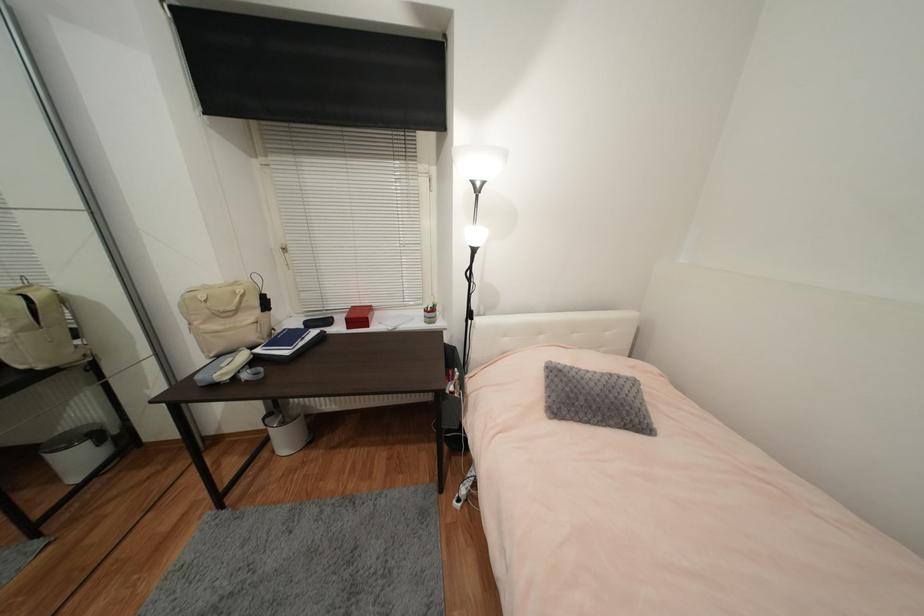
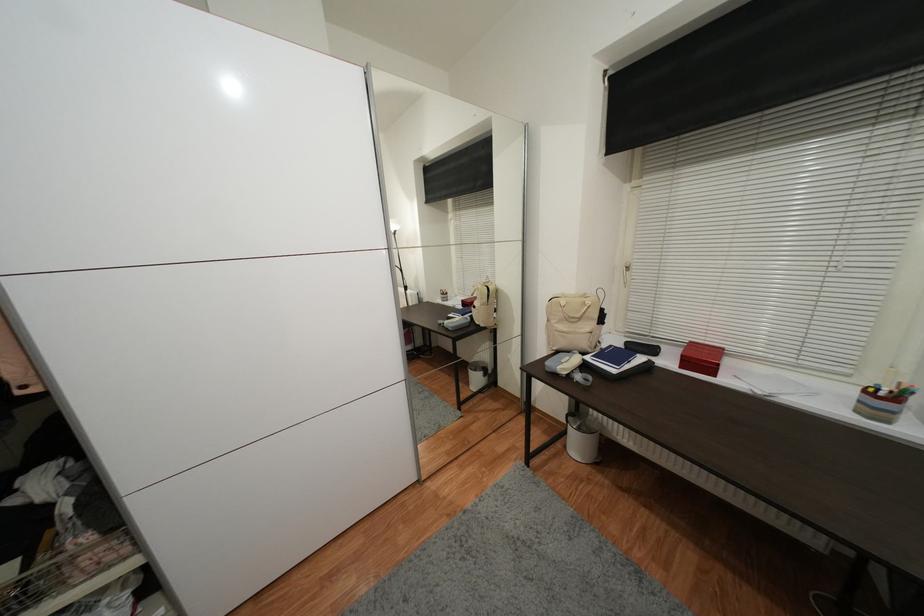
The point at [277,453] is marked in the first image. Where is the corresponding point in the second image?

(569, 448)